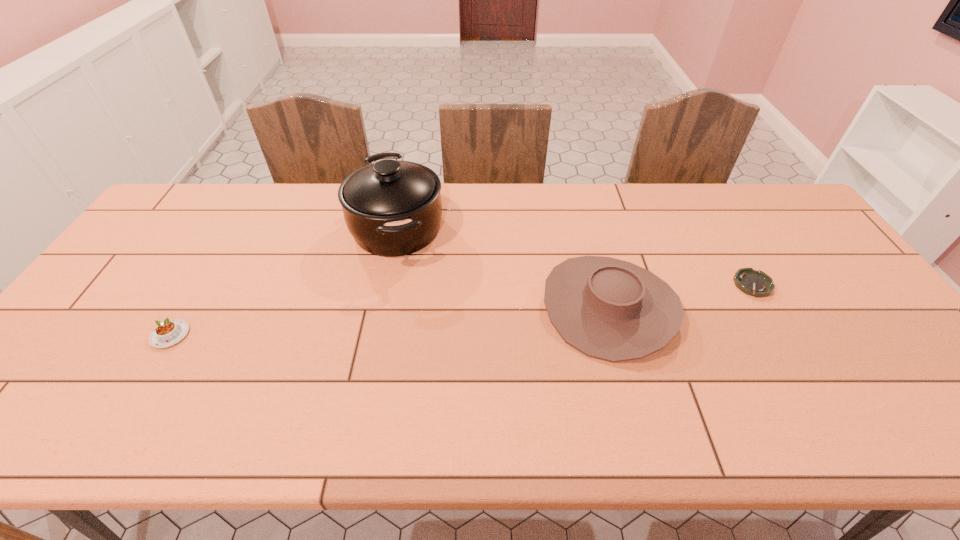
Image resolution: width=960 pixels, height=540 pixels. I want to click on saucepan, so click(392, 208).

At what (x,y) coordinates should I click in order to perform the action: click on the tallest object. Please return your answer as a coordinate pair (x, y). This screenshot has width=960, height=540. Looking at the image, I should click on (392, 208).

What are the coordinates of `the second tallest object` in the screenshot? It's located at (609, 309).

Find the location of a particular element. cowboy hat is located at coordinates (609, 309).

I want to click on pudding, so click(167, 333).

At what (x,y) coordinates should I click in order to perform the action: click on the leftmost object. Please return your answer as a coordinate pair (x, y). The height and width of the screenshot is (540, 960). Looking at the image, I should click on (167, 333).

Identify the location of the rightmost object. (755, 283).

Where is `ashtray`? ashtray is located at coordinates point(755,283).

Find the location of `free space located 0.100m on the left of the tallest object`. free space located 0.100m on the left of the tallest object is located at coordinates (318, 228).

Find the location of a particular element. This screenshot has width=960, height=540. vacant space situated on the right of the cowboy hat is located at coordinates (801, 307).